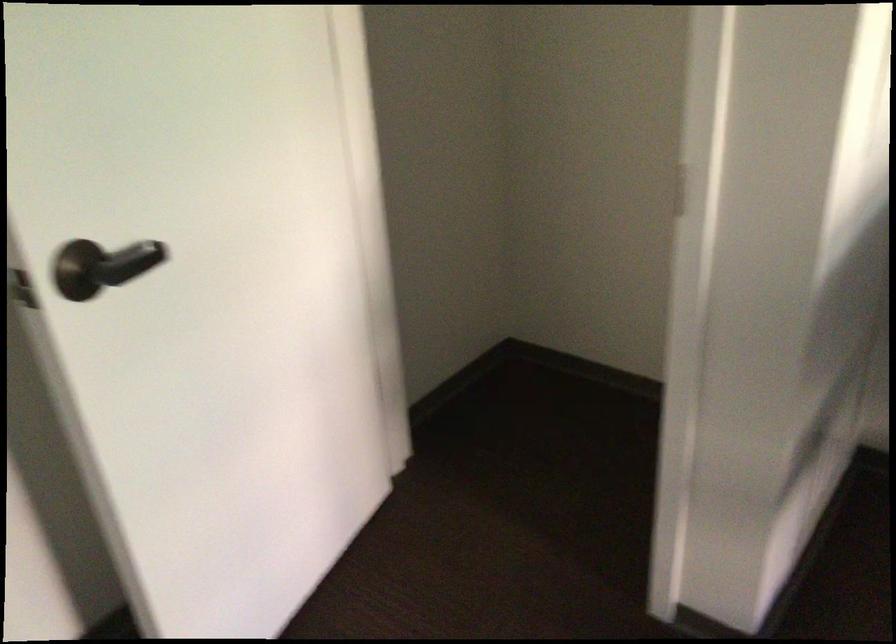
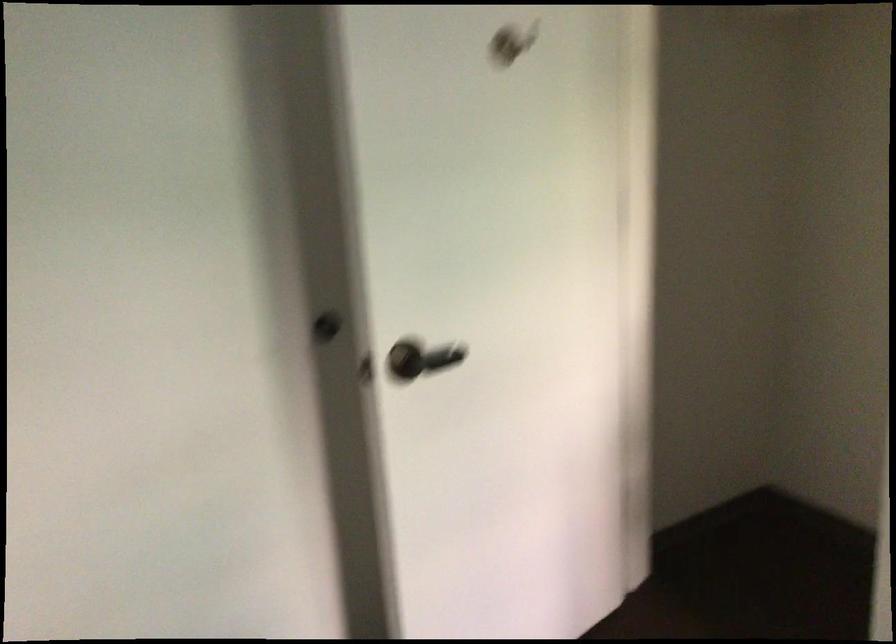
Where in the second image is the point corresponding to pixel 83 270 from the first image?

(407, 359)